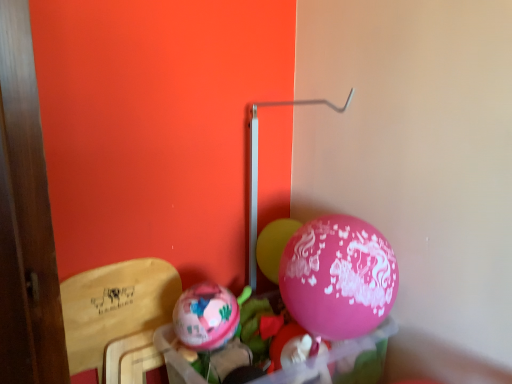
Question: Considering the relative sizes of matte pink balloon at center, the 2th balloon when ordered from back to front, and wooden armchair at left in the image provided, is matte pink balloon at center, the 2th balloon when ordered from back to front, wider than wooden armchair at left?

Choices:
 (A) yes
 (B) no

Answer: (B)

Question: From a real-world perspective, is matte pink balloon at center, the 2th balloon when ordered from back to front, positioned under wooden armchair at left based on gravity?

Choices:
 (A) yes
 (B) no

Answer: (B)

Question: Does matte pink balloon at center, the 1th balloon when ordered from left to right, have a lesser height compared to wooden armchair at left?

Choices:
 (A) yes
 (B) no

Answer: (A)

Question: Is matte pink balloon at center, positioned as the second balloon in right-to-left order, surrounding wooden armchair at left?

Choices:
 (A) no
 (B) yes

Answer: (A)

Question: Is matte pink balloon at center, which ranks as the 1th balloon in front-to-back order, positioned behind wooden armchair at left?

Choices:
 (A) yes
 (B) no

Answer: (A)

Question: In terms of height, does pink glossy balloon at center, which appears as the first balloon when viewed from the back, look taller or shorter compared to matte pink balloon at center, the 2th balloon when ordered from back to front?

Choices:
 (A) tall
 (B) short

Answer: (A)

Question: Considering the positions of pink glossy balloon at center, arranged as the first balloon when viewed from the right, and matte pink balloon at center, which ranks as the 1th balloon in front-to-back order, in the image, is pink glossy balloon at center, arranged as the first balloon when viewed from the right, bigger or smaller than matte pink balloon at center, which ranks as the 1th balloon in front-to-back order,?

Choices:
 (A) small
 (B) big

Answer: (B)

Question: From the image's perspective, is pink glossy balloon at center, acting as the 2th balloon starting from the left, located above or below matte pink balloon at center, which ranks as the 1th balloon in front-to-back order?

Choices:
 (A) above
 (B) below

Answer: (A)

Question: Do you think pink glossy balloon at center, acting as the 2th balloon starting from the left, is within matte pink balloon at center, the 1th balloon when ordered from left to right, or outside of it?

Choices:
 (A) inside
 (B) outside

Answer: (B)

Question: Looking at their shapes, would you say matte pink balloon at center, the 1th balloon when ordered from left to right, is wider or thinner than pink glossy balloon at center, which is counted as the second balloon, starting from the front?

Choices:
 (A) wide
 (B) thin

Answer: (B)

Question: From a real-world perspective, relative to pink glossy balloon at center, which appears as the first balloon when viewed from the back, is matte pink balloon at center, the 1th balloon when ordered from left to right, vertically above or below?

Choices:
 (A) above
 (B) below

Answer: (B)

Question: From their relative heights in the image, would you say matte pink balloon at center, positioned as the second balloon in right-to-left order, is taller or shorter than pink glossy balloon at center, arranged as the first balloon when viewed from the right?

Choices:
 (A) tall
 (B) short

Answer: (B)

Question: Based on their sizes in the image, would you say matte pink balloon at center, which ranks as the 1th balloon in front-to-back order, is bigger or smaller than pink glossy balloon at center, arranged as the first balloon when viewed from the right?

Choices:
 (A) small
 (B) big

Answer: (A)

Question: From a real-world perspective, is pink glossy balloon at center, acting as the 2th balloon starting from the left, physically located above or below wooden armchair at left?

Choices:
 (A) below
 (B) above

Answer: (B)

Question: Looking at their shapes, would you say pink glossy balloon at center, which appears as the first balloon when viewed from the back, is wider or thinner than wooden armchair at left?

Choices:
 (A) wide
 (B) thin

Answer: (B)